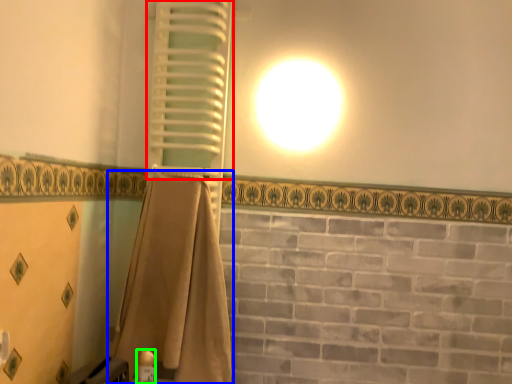
Question: Which is farther away from shutter (highlighted by a red box)? curtain (highlighted by a blue box) or toiletry (highlighted by a green box)?

Choices:
 (A) curtain
 (B) toiletry

Answer: (B)